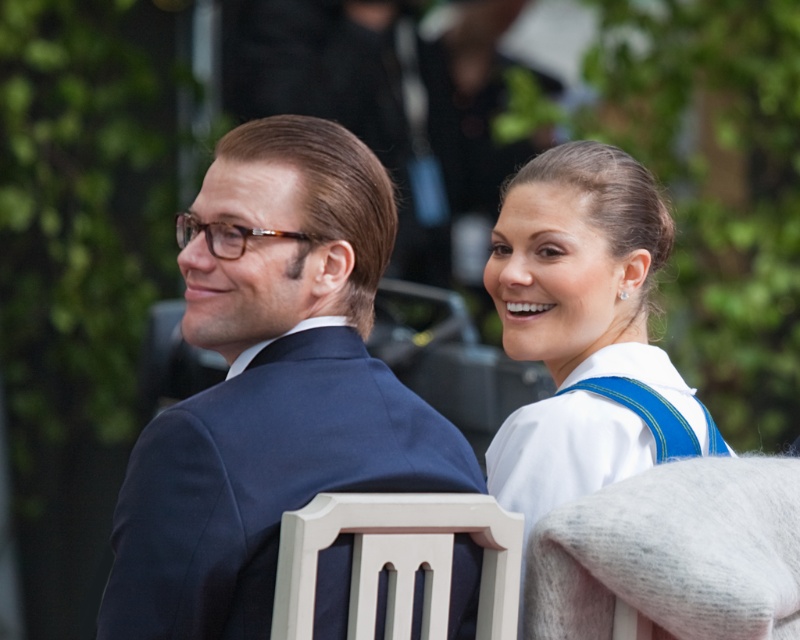
Question: Which of the following is the farthest from the observer?

Choices:
 (A) navy blue suit at left
 (B) white painted wood chair at center
 (C) white fabric dress at upper right

Answer: (C)

Question: Which object is the farthest from the navy blue suit at left?

Choices:
 (A) white painted wood chair at center
 (B) white fabric dress at upper right

Answer: (B)

Question: Can you confirm if navy blue suit at left is positioned below white fabric dress at upper right?

Choices:
 (A) no
 (B) yes

Answer: (A)

Question: Does navy blue suit at left have a larger size compared to white fabric dress at upper right?

Choices:
 (A) no
 (B) yes

Answer: (A)

Question: Where is navy blue suit at left located in relation to white fabric dress at upper right in the image?

Choices:
 (A) below
 (B) above

Answer: (B)

Question: Among these points, which one is nearest to the camera?

Choices:
 (A) (518, 282)
 (B) (150, 547)
 (C) (496, 563)

Answer: (B)